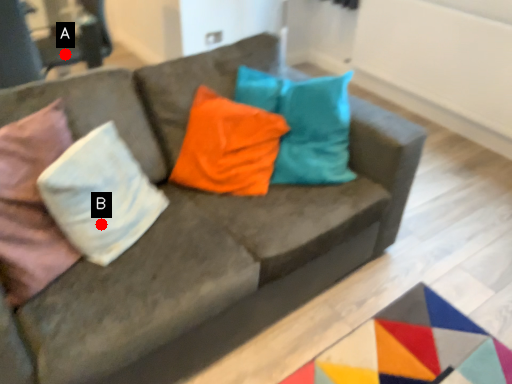
Question: Two points are circled on the image, labeled by A and B beside each circle. Among these points, which one is farthest from the camera?

Choices:
 (A) A is further
 (B) B is further

Answer: (A)